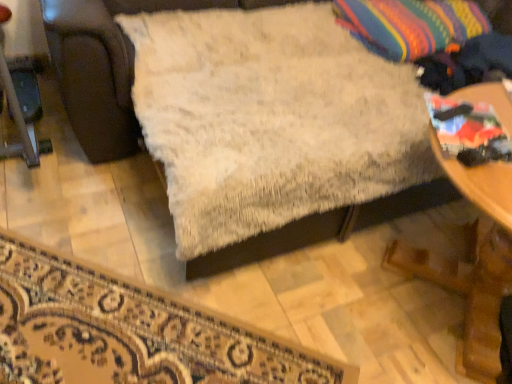
Identify the location of free space that is to the left of wooden table at lower right. The image size is (512, 384). (282, 313).